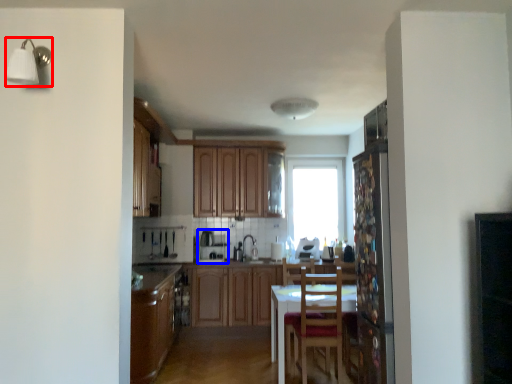
Question: Which object appears farthest to the camera in this image, light fixture (highlighted by a red box) or appliance (highlighted by a blue box)?

Choices:
 (A) light fixture
 (B) appliance

Answer: (B)